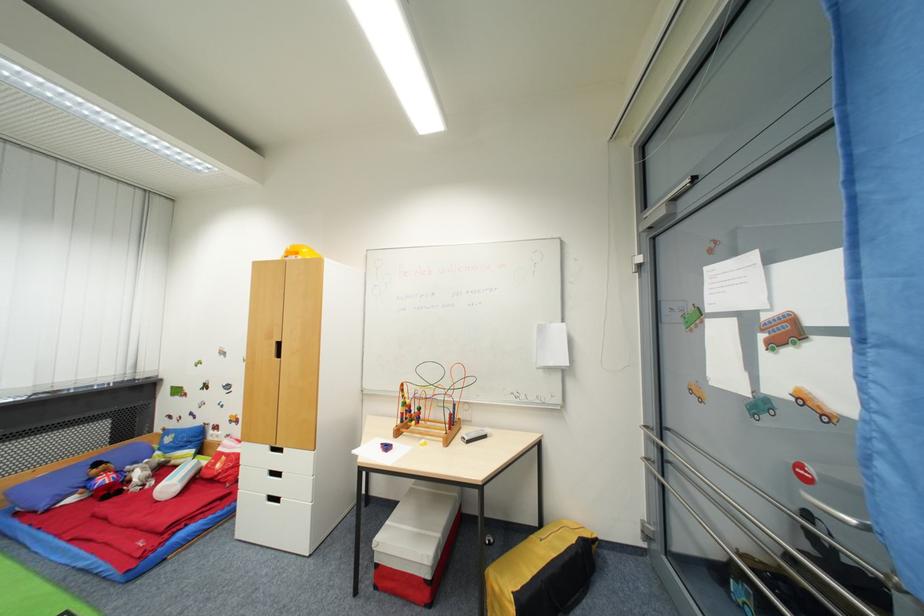
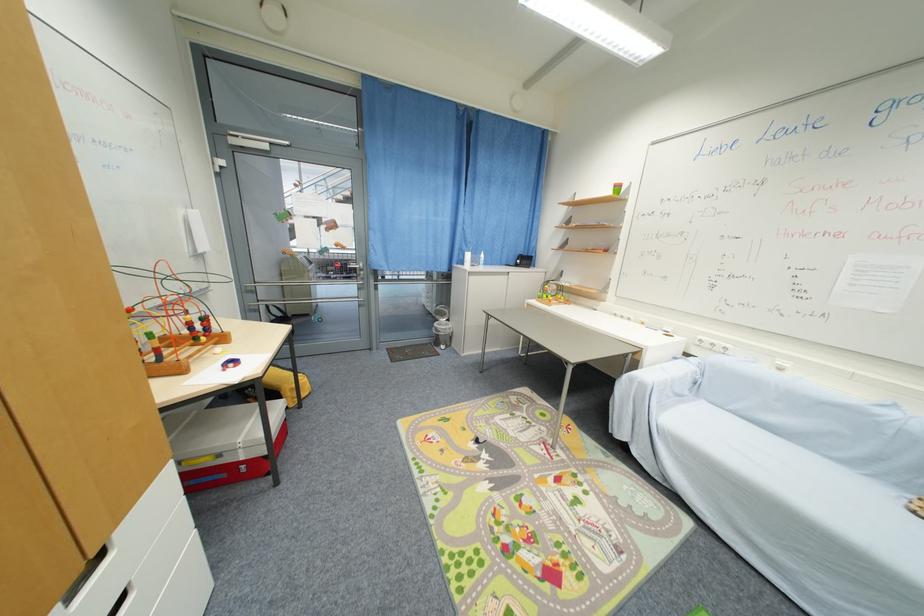
Locate, in the second image, the point that corresponds to point 417,422 in the first image.

(201, 341)